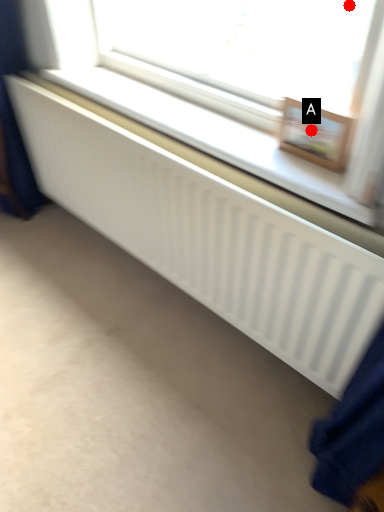
Question: Two points are circled on the image, labeled by A and B beside each circle. Which point is farther to the camera?

Choices:
 (A) A is further
 (B) B is further

Answer: (A)